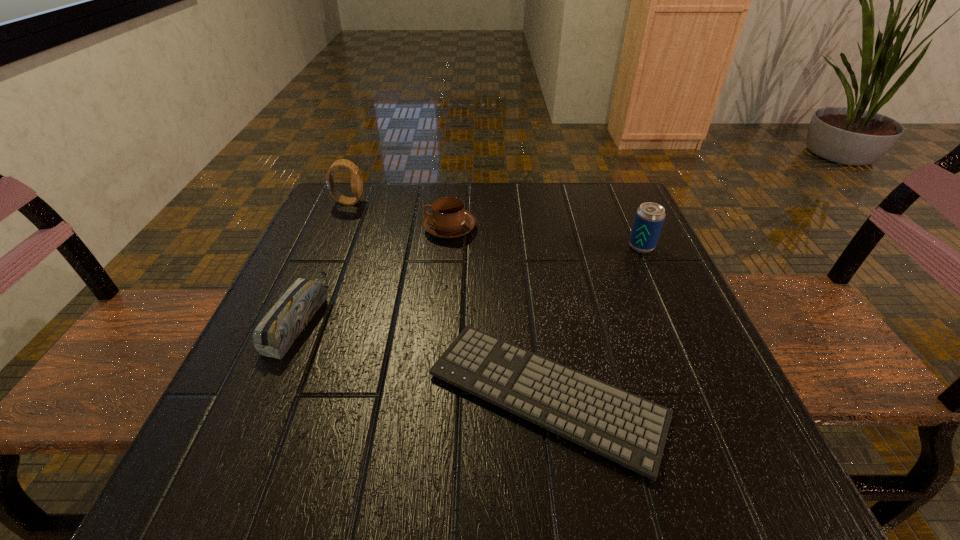
I want to click on blank region between the computer keyboard and the pencil box, so click(x=422, y=356).

This screenshot has width=960, height=540. In order to click on vacant space in between the beer can and the cappuccino in this screenshot , I will do `click(545, 237)`.

The height and width of the screenshot is (540, 960). In order to click on free point between the beer can and the watch in this screenshot , I will do `click(494, 224)`.

Where is `free space between the shortest object and the beer can`? free space between the shortest object and the beer can is located at coordinates (594, 320).

You are a GUI agent. You are given a task and a screenshot of the screen. Output one action in this format:
    pyautogui.click(x=<x>, y=<y>)
    Task: Click on the vacant area that lies between the watch and the cappuccino
    This screenshot has width=960, height=540.
    Given the screenshot: What is the action you would take?
    pyautogui.click(x=398, y=215)

In order to click on vacant region between the rightmost object and the cappuccino in this screenshot , I will do `click(545, 237)`.

Image resolution: width=960 pixels, height=540 pixels. Identify the location of vacant area between the farthest object and the cappuccino. (398, 215).

Identify which object is the fourth closest to the cappuccino. Please provide its 2D coordinates. Your answer should be formatted as a tuple, i.e. [(x, y)], where the tuple contains the x and y coordinates of a point satisfying the conditions above.

[(649, 218)]

Find the location of a particular element. object identified as the fourth closest to the farthest object is located at coordinates (649, 218).

Where is `vacant region that satisfies the following two spatial constraints: 1. on the face of the computer keyboard; 2. on the right side of the watch`? The image size is (960, 540). vacant region that satisfies the following two spatial constraints: 1. on the face of the computer keyboard; 2. on the right side of the watch is located at coordinates [x=266, y=394].